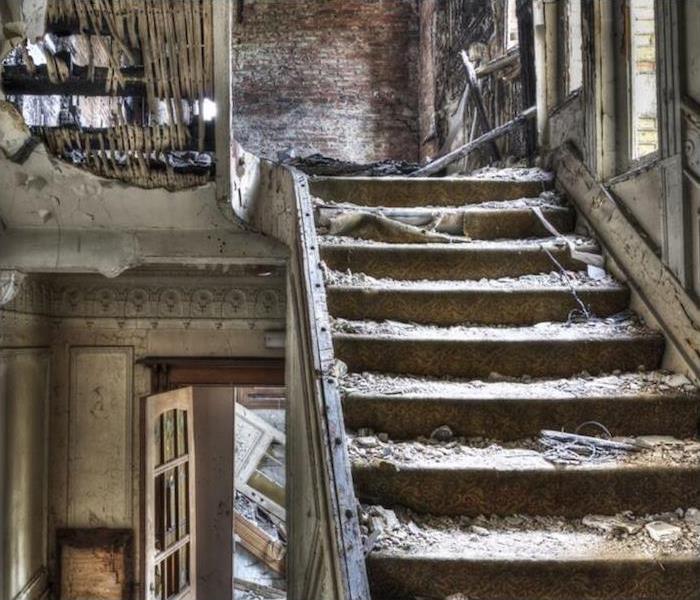
In order to click on moulding in this screenshot , I will do `click(190, 297)`.